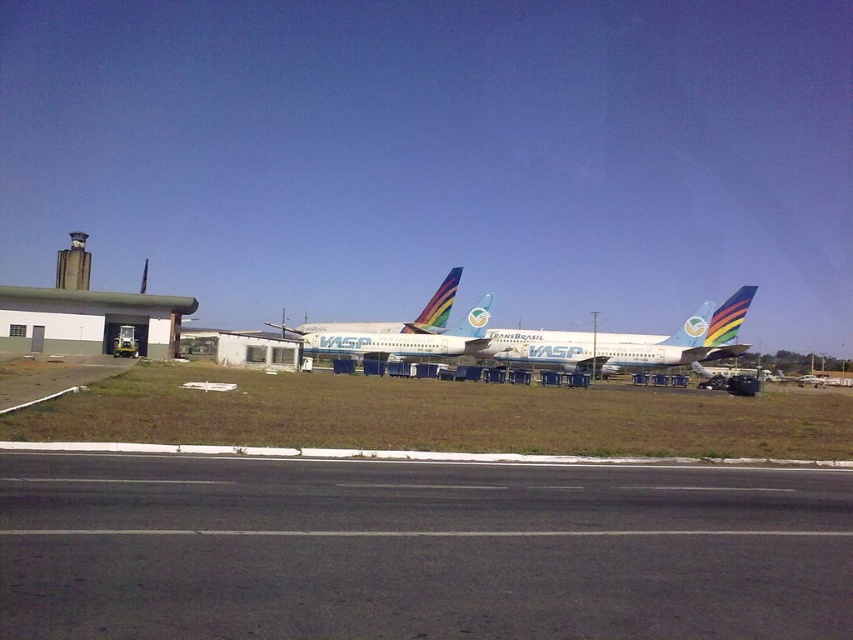
Which of these two, black asphalt runway at center or white glossy airliner at center, stands shorter?

With less height is black asphalt runway at center.

Identify the location of black asphalt runway at center. The image size is (853, 640). (418, 550).

Identify the location of black asphalt runway at center. (418, 550).

Does white glossy airliner at center lie behind white glossy airplane at center?

That is False.

Does white glossy airliner at center have a lesser height compared to white glossy airplane at center?

Yes.

Does point (717, 352) come closer to viewer compared to point (363, 342)?

Yes, it is.

Where is `white glossy airliner at center`? Image resolution: width=853 pixels, height=640 pixels. white glossy airliner at center is located at coordinates (637, 342).

Is black asphalt runway at center bigger than white glossy airplane at center?

No.

What do you see at coordinates (418, 550) in the screenshot? The image size is (853, 640). I see `black asphalt runway at center` at bounding box center [418, 550].

This screenshot has width=853, height=640. I want to click on black asphalt runway at center, so click(x=418, y=550).